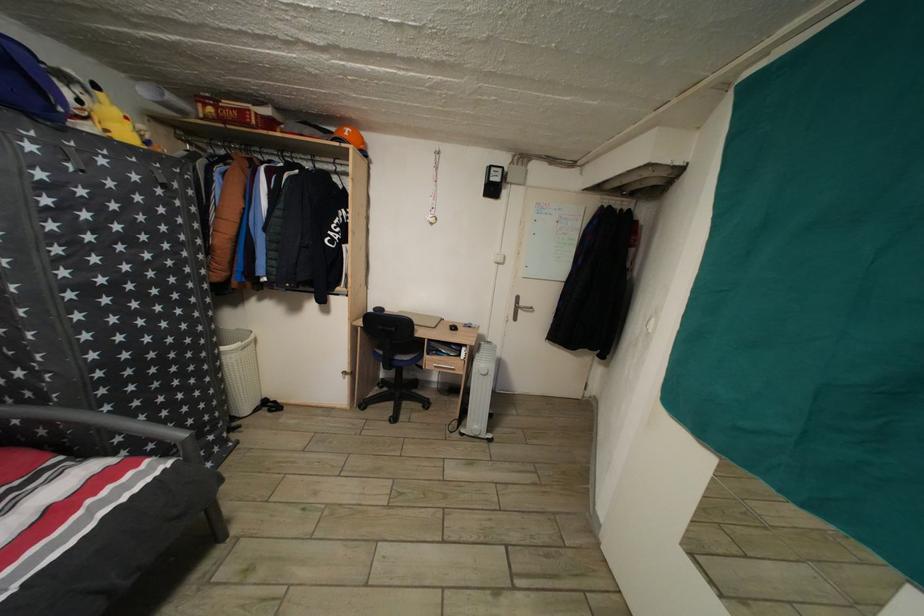
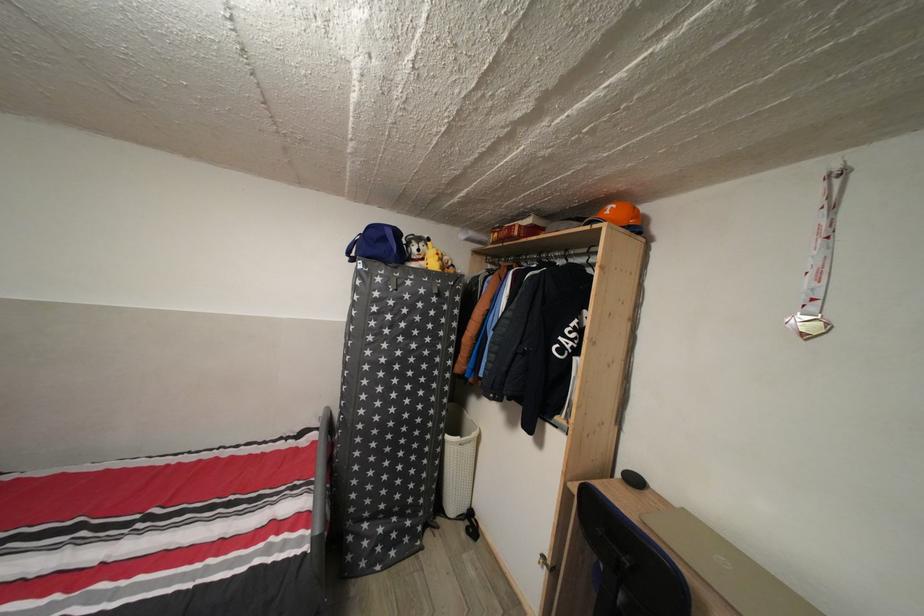
Find the pixel in the second image that matches [138,394] in the first image.

(380, 451)